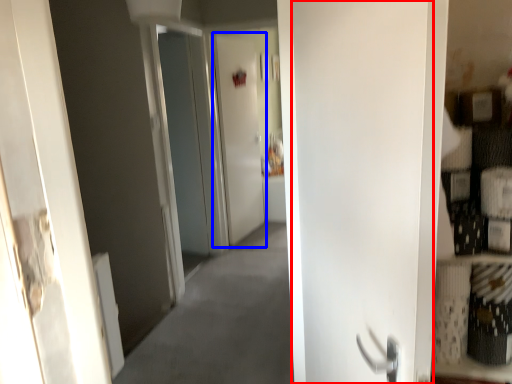
Question: Which point is closer to the camera, door (highlighted by a red box) or screen door (highlighted by a blue box)?

Choices:
 (A) door
 (B) screen door

Answer: (A)